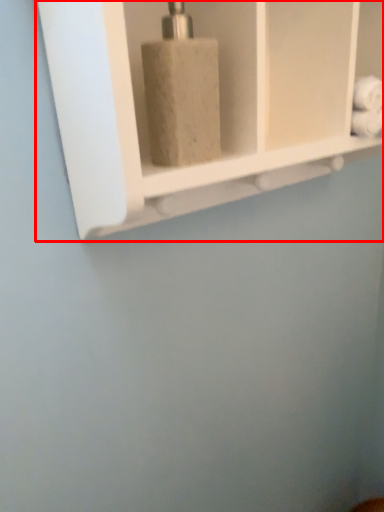
Question: From the image's perspective, what is the correct spatial positioning of shelf (annotated by the red box) in reference to soap dispenser?

Choices:
 (A) above
 (B) below

Answer: (A)